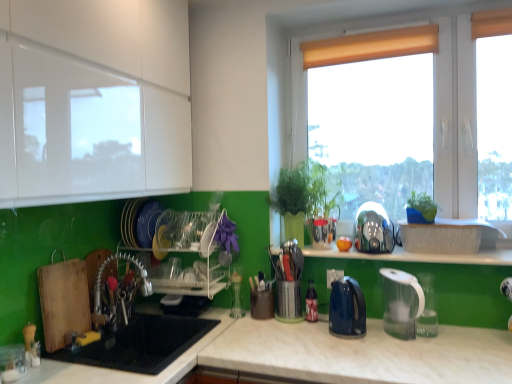
Question: Looking at their shapes, would you say black matte sink at lower left is wider or thinner than matte white window at upper right?

Choices:
 (A) thin
 (B) wide

Answer: (B)

Question: Is point (113, 332) positioned closer to the camera than point (303, 125)?

Choices:
 (A) farther
 (B) closer

Answer: (B)

Question: Estimate the real-world distances between objects in this image. Which object is farther from the clear plastic dish rack at center?

Choices:
 (A) brushed metal faucet at lower left
 (B) translucent plastic bottle at center
 (C) matte white window at upper right
 (D) metallic utensil holder at center, acting as the 1th appliance starting from the left
 (E) black matte sink at lower left

Answer: (C)

Question: Which is nearer to the green matte plant at center, which appears as the 1th plant when viewed from the left?

Choices:
 (A) black matte sink at lower left
 (B) metallic silver toaster at center
 (C) shiny metallic kettle at center-right, which is counted as the 1th appliance, starting from the top
 (D) clear plastic dish rack at center
 (E) beige fabric curtain at upper center

Answer: (C)